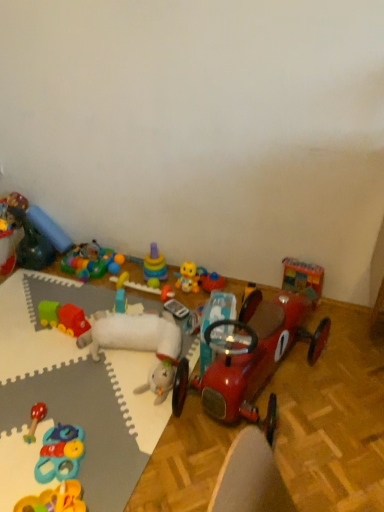
Identify the location of vacant space to the right of wooden toy car at upper right, the twelfth toy when ordered from left to right. (340, 316).